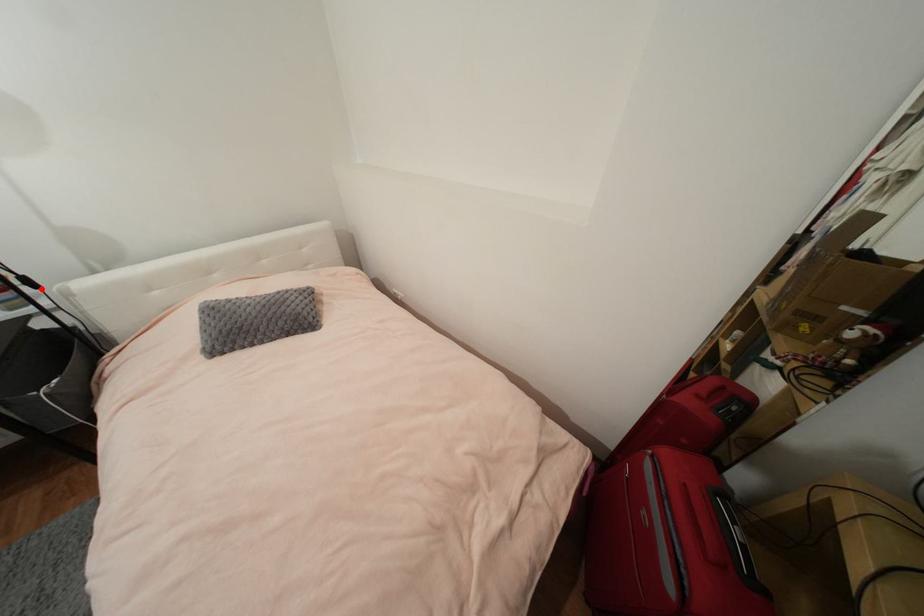
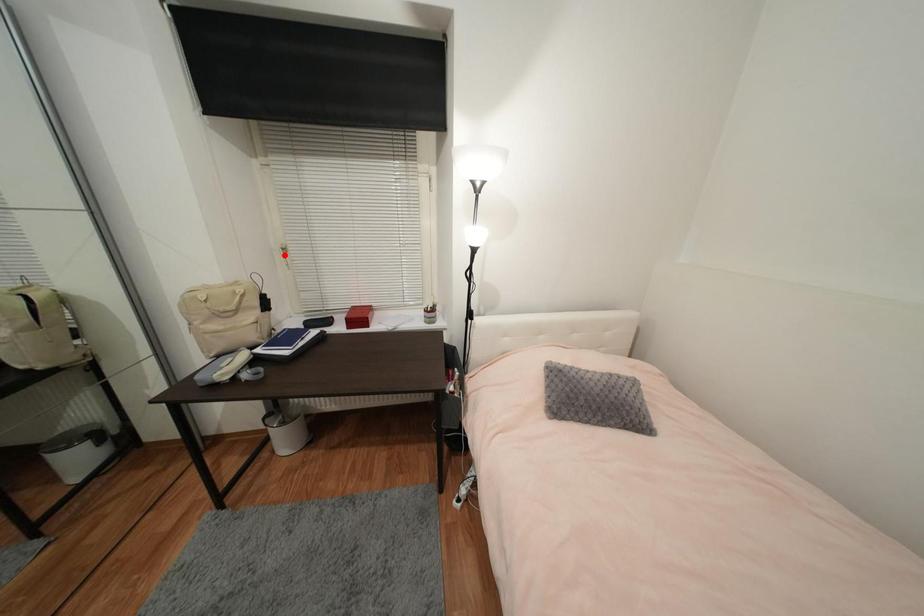
I am providing you with two images of the same scene from different viewpoints. A red point is marked on the first image and another point is marked on the second image. Is the red point in image1 aligned with the point shown in image2?

No